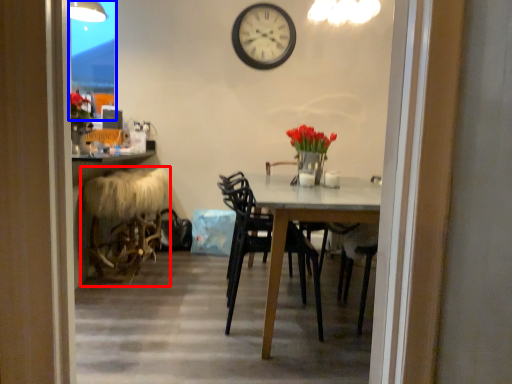
Question: Which point is closer to the camera, folding chair (highlighted by a red box) or glass door (highlighted by a blue box)?

Choices:
 (A) folding chair
 (B) glass door

Answer: (A)